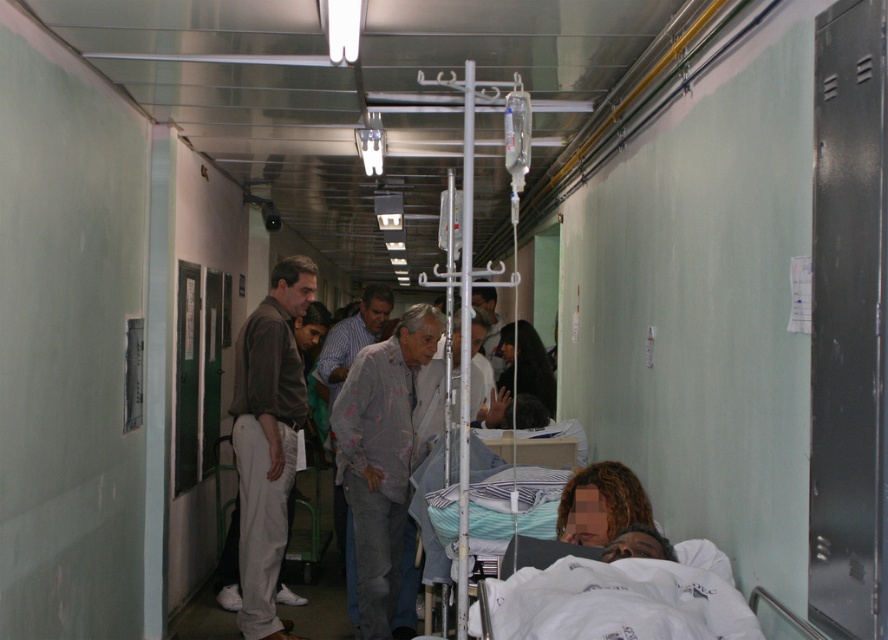
Question: Does light brown fabric pants at left have a smaller size compared to dark brown hair at center?

Choices:
 (A) no
 (B) yes

Answer: (A)

Question: Is the position of light brown fabric pants at left less distant than that of dark brown hair at center?

Choices:
 (A) no
 (B) yes

Answer: (B)

Question: Which point is closer to the camera taking this photo?

Choices:
 (A) (x=498, y=342)
 (B) (x=242, y=580)

Answer: (B)

Question: Which object is closer to the camera taking this photo?

Choices:
 (A) light brown fabric pants at left
 (B) dark brown hair at center

Answer: (A)

Question: Can you confirm if light brown fabric pants at left is positioned to the right of dark brown hair at center?

Choices:
 (A) yes
 (B) no

Answer: (B)